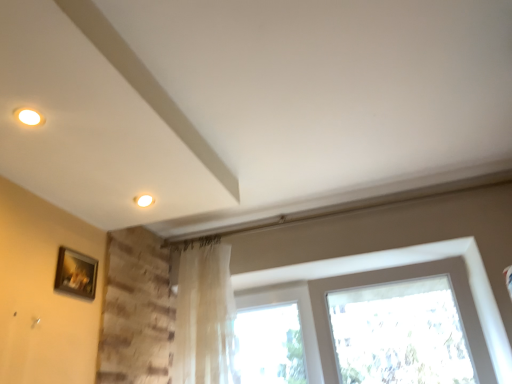
Question: Is translucent fabric curtain at center at the left side of wooden picture frame at lower left?

Choices:
 (A) yes
 (B) no

Answer: (B)

Question: Can you confirm if translucent fabric curtain at center is bigger than wooden picture frame at lower left?

Choices:
 (A) yes
 (B) no

Answer: (A)

Question: Is translucent fabric curtain at center at the right side of wooden picture frame at lower left?

Choices:
 (A) no
 (B) yes

Answer: (B)

Question: From the image's perspective, is translucent fabric curtain at center located beneath wooden picture frame at lower left?

Choices:
 (A) no
 (B) yes

Answer: (B)

Question: Considering the relative sizes of translucent fabric curtain at center and wooden picture frame at lower left in the image provided, is translucent fabric curtain at center taller than wooden picture frame at lower left?

Choices:
 (A) no
 (B) yes

Answer: (B)

Question: Would you say translucent fabric curtain at center contains wooden picture frame at lower left?

Choices:
 (A) no
 (B) yes

Answer: (A)

Question: Is translucent fabric curtain at center to the right of translucent fabric at center from the viewer's perspective?

Choices:
 (A) yes
 (B) no

Answer: (B)

Question: From the image's perspective, is translucent fabric curtain at center below translucent fabric at center?

Choices:
 (A) no
 (B) yes

Answer: (A)

Question: Could translucent fabric at center be considered to be inside translucent fabric curtain at center?

Choices:
 (A) no
 (B) yes

Answer: (A)

Question: Could you tell me if translucent fabric curtain at center is facing translucent fabric at center?

Choices:
 (A) yes
 (B) no

Answer: (B)

Question: Can you confirm if translucent fabric curtain at center is wider than translucent fabric at center?

Choices:
 (A) yes
 (B) no

Answer: (B)

Question: Is the position of translucent fabric curtain at center more distant than that of translucent fabric at center?

Choices:
 (A) no
 (B) yes

Answer: (B)

Question: Is translucent fabric at center at the right side of wooden picture frame at lower left?

Choices:
 (A) yes
 (B) no

Answer: (A)